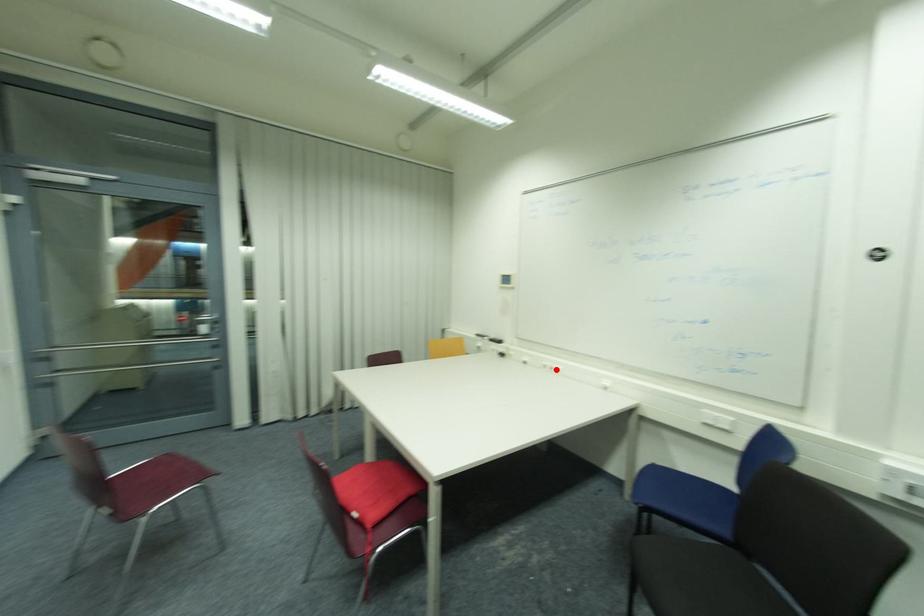
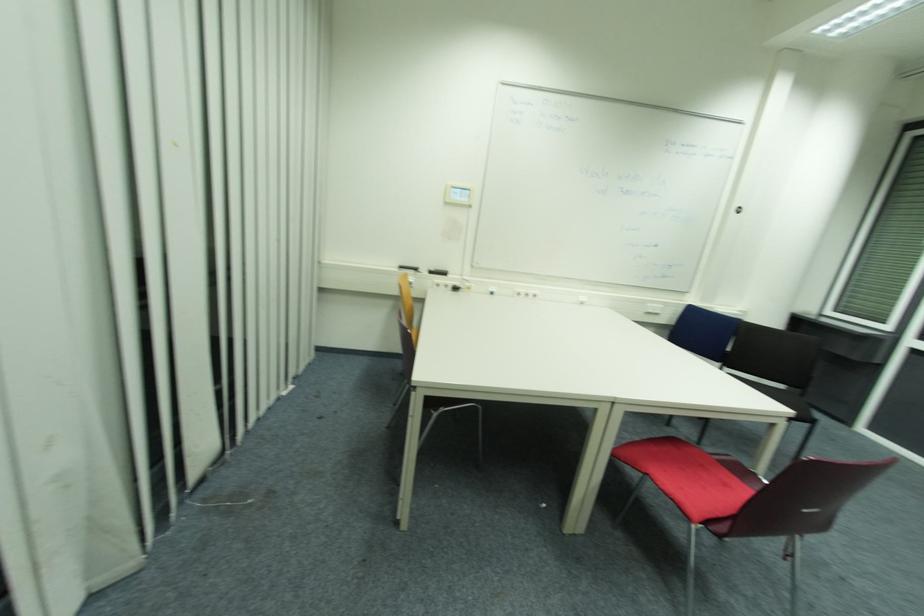
In the second image, find the point that corresponds to the highlighted location in the first image.

(529, 294)